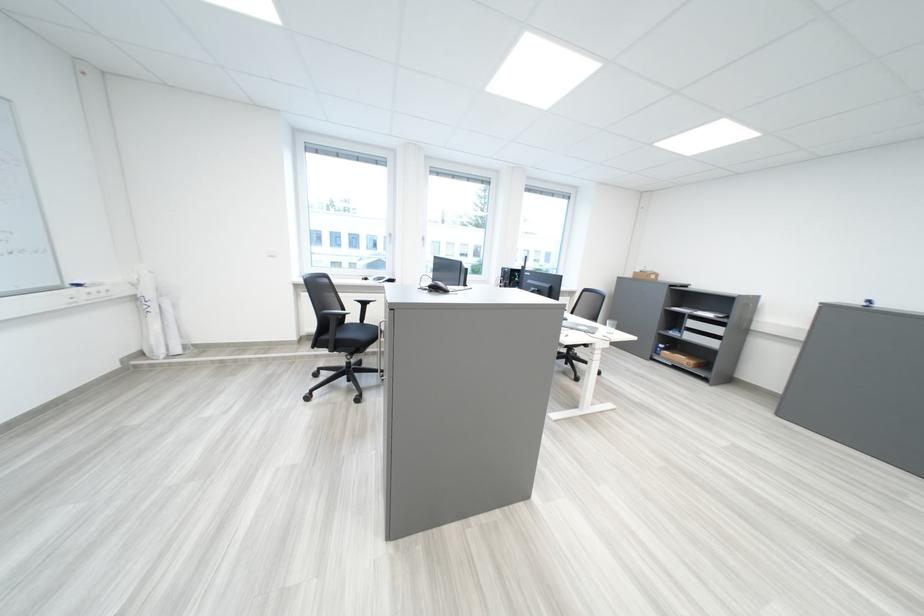
Where is `black chair armrest`? This screenshot has height=616, width=924. black chair armrest is located at coordinates (335, 314).